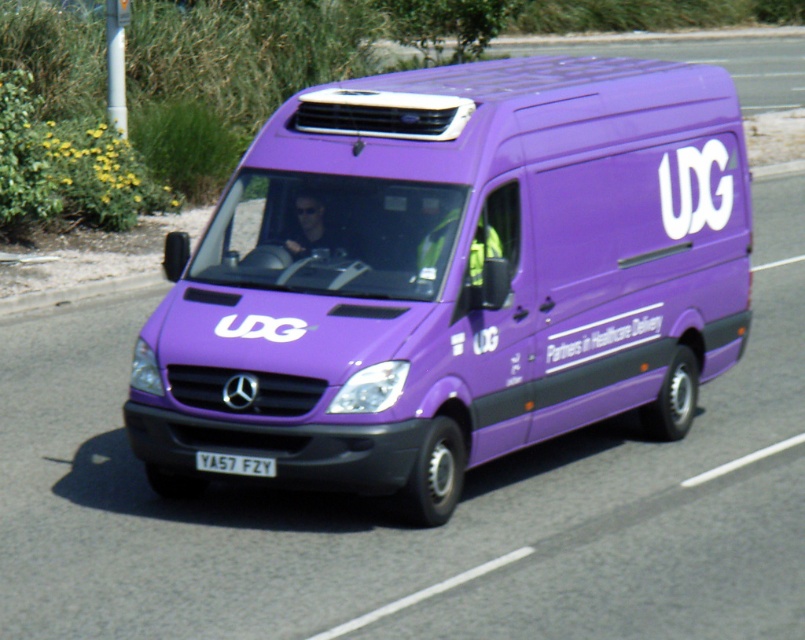
You are a traffic officer observing a vehicle. You notice a purple matte van at center and a white plastic license plate at center. Which object is positioned more to the right side of the image?

The purple matte van at center is positioned to the right of the white plastic license plate at center, so the van is more to the right.

You are a delivery driver who needs to park the purple matte van at center at a specific point. The parking spot is marked at coordinate point (452, 276). Can you confirm if the van is already parked correctly at this point?

The purple matte van at center is located at point (452, 276), so yes, it is parked correctly at the specified coordinate point.